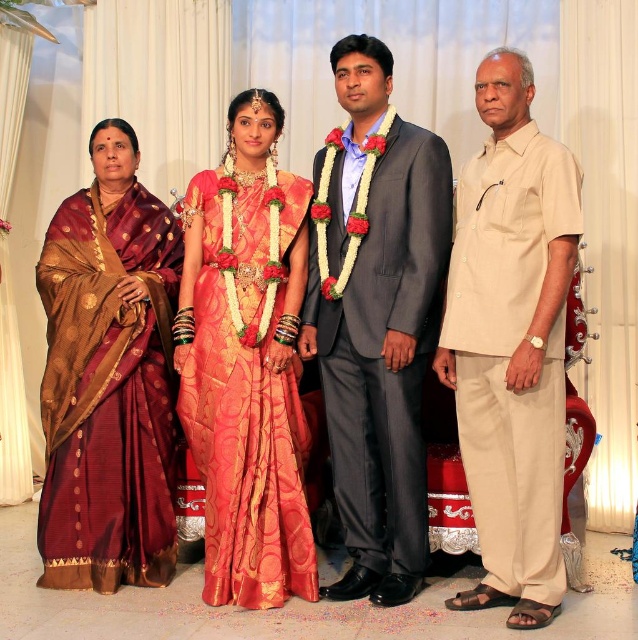
Question: Does beige cotton kurta at right appear over silk saree at center?

Choices:
 (A) no
 (B) yes

Answer: (B)

Question: Is matte gray suit at center wider than silk saree at center?

Choices:
 (A) yes
 (B) no

Answer: (A)

Question: Estimate the real-world distances between objects in this image. Which object is closer to the maroon silk saree at left?

Choices:
 (A) beige cotton kurta at right
 (B) silk saree at center

Answer: (B)

Question: Among these points, which one is farthest from the camera?

Choices:
 (A) (84, 536)
 (B) (521, 100)
 (C) (339, 240)
 (D) (232, 209)

Answer: (D)

Question: Which object appears closest to the camera in this image?

Choices:
 (A) silk saree at center
 (B) beige cotton kurta at right

Answer: (B)

Question: Does beige cotton kurta at right lie behind maroon silk saree at left?

Choices:
 (A) no
 (B) yes

Answer: (A)